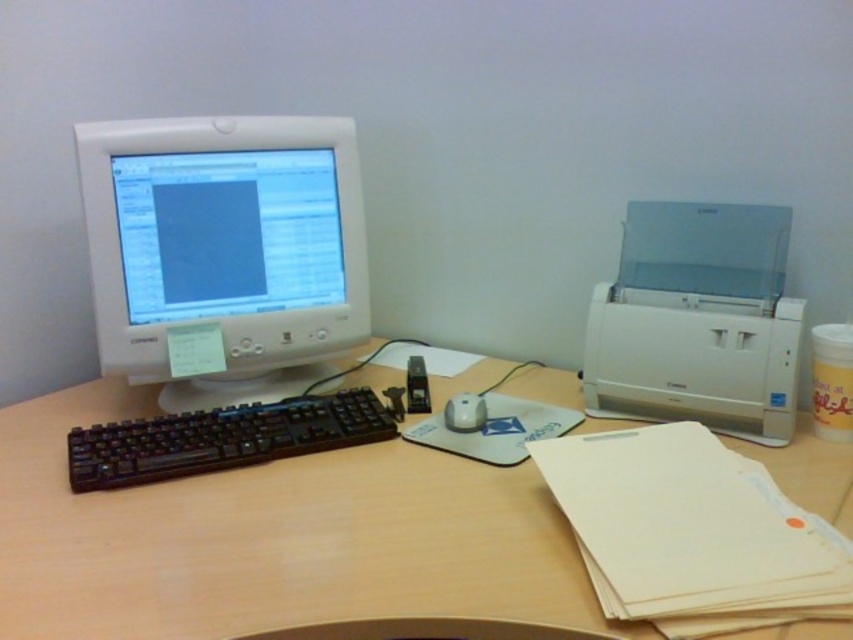
You are organizing the desk and need to place a new item between the white plastic printer at right and the white glossy mouse at center. Considering their heights, which one should you place on the lower shelf to save space?

The white glossy mouse at center is shorter than the white plastic printer at right, so placing it on the lower shelf would save space.

You are organizing your desk and want to place a 25 cm wide laptop between the white glossy monitor at upper left and the black plastic keyboard at left. Will there be enough space?

The distance between the white glossy monitor at upper left and the black plastic keyboard at left is 25.29 centimeters, so the 25 cm wide laptop can fit between them with a small amount of space remaining.

You are an office worker who needs to print a document. You are currently at the center of the desk. Which direction should you move to reach the white plastic printer at right?

Since the white plastic printer at right is located at coordinates (697,321), you should move to the right side of the desk to reach it.